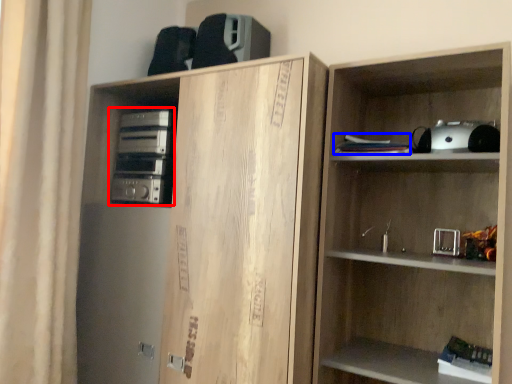
Question: Which point is further to the camera, stereo (highlighted by a red box) or book (highlighted by a blue box)?

Choices:
 (A) stereo
 (B) book

Answer: (A)